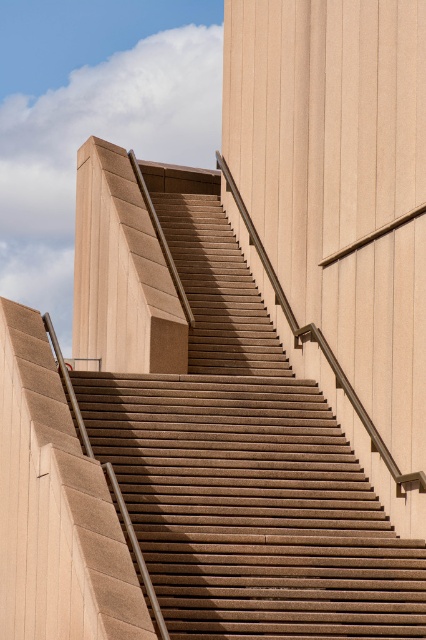
Question: Which point is closer to the camera taking this photo?

Choices:
 (A) (88, 426)
 (B) (176, 348)

Answer: (A)

Question: Can you confirm if brown textured stairs at center is wider than sandy beige concrete pillar at upper left?

Choices:
 (A) yes
 (B) no

Answer: (A)

Question: Does brown textured stairs at center have a larger size compared to sandy beige concrete pillar at upper left?

Choices:
 (A) no
 (B) yes

Answer: (B)

Question: Where is brown textured stairs at center located in relation to sandy beige concrete pillar at upper left in the image?

Choices:
 (A) right
 (B) left

Answer: (A)

Question: Which of the following is the closest to the observer?

Choices:
 (A) sandy beige concrete pillar at upper left
 (B) brown textured stairs at center

Answer: (B)

Question: Which point is closer to the camera?

Choices:
 (A) sandy beige concrete pillar at upper left
 (B) brown textured stairs at center

Answer: (B)